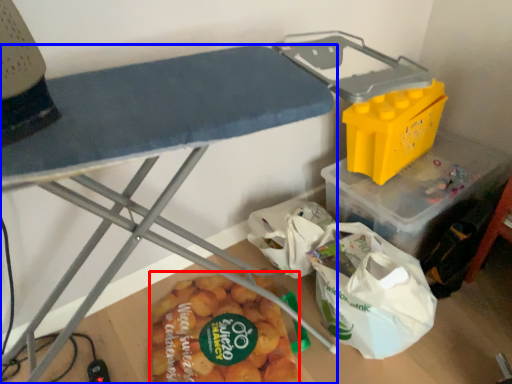
Question: Which of the following is the closest to the observer, food (highlighted by a red box) or furniture (highlighted by a blue box)?

Choices:
 (A) food
 (B) furniture

Answer: (B)